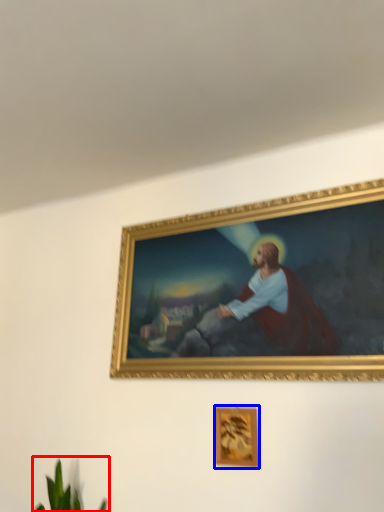
Question: Which point is closer to the camera, plant (highlighted by a red box) or picture frame (highlighted by a blue box)?

Choices:
 (A) plant
 (B) picture frame

Answer: (A)